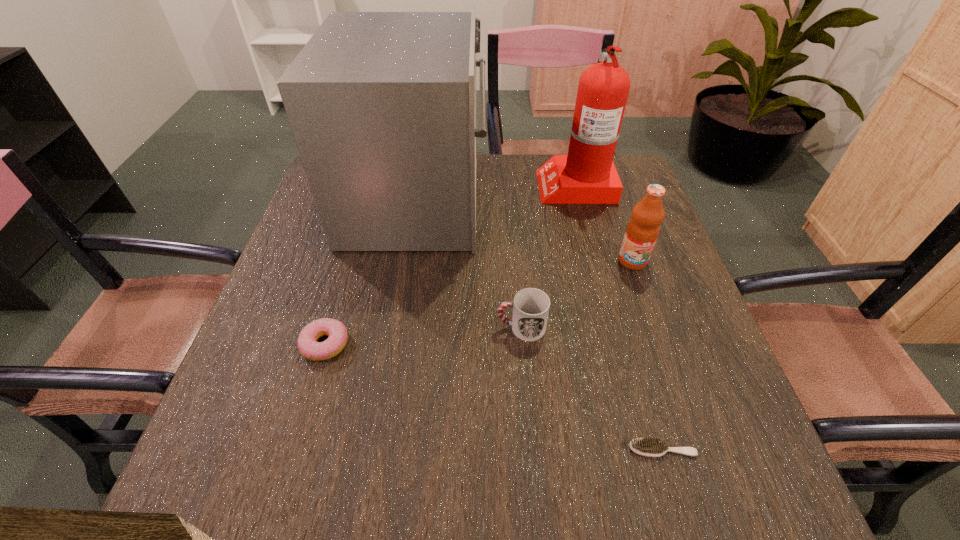
The width and height of the screenshot is (960, 540). What are the coordinates of `free space located 0.290m on the front-facing side of the fire extinguisher` in the screenshot? It's located at (438, 184).

In order to click on vacant region located 0.070m on the front-facing side of the fire extinguisher in this screenshot , I will do `click(514, 184)`.

The image size is (960, 540). In order to click on vacant space located 0.110m on the front label of the third tallest object in this screenshot , I will do `click(649, 307)`.

Image resolution: width=960 pixels, height=540 pixels. I want to click on vacant region located on the side of the fourth tallest object where the handle is located, so click(x=405, y=327).

Identify the location of blank area located 0.220m on the side of the fourth tallest object where the handle is located. (391, 327).

In order to click on vacant space located 0.310m on the side of the fourth tallest object where the handle is located in this screenshot , I will do `click(348, 327)`.

In order to click on vacant region located 0.220m on the right of the doughnut in this screenshot , I will do `click(459, 345)`.

You are a GUI agent. You are given a task and a screenshot of the screen. Output one action in this format:
    pyautogui.click(x=<x>, y=<y>)
    Task: Click on the free space located 0.150m on the left of the shortest object
    The height and width of the screenshot is (540, 960).
    Given the screenshot: What is the action you would take?
    pyautogui.click(x=540, y=448)

Image resolution: width=960 pixels, height=540 pixels. In order to click on toaster oven at the far edge in this screenshot , I will do `click(382, 105)`.

Locate an element on the screen. The width and height of the screenshot is (960, 540). fire extinguisher located at the far edge is located at coordinates (587, 175).